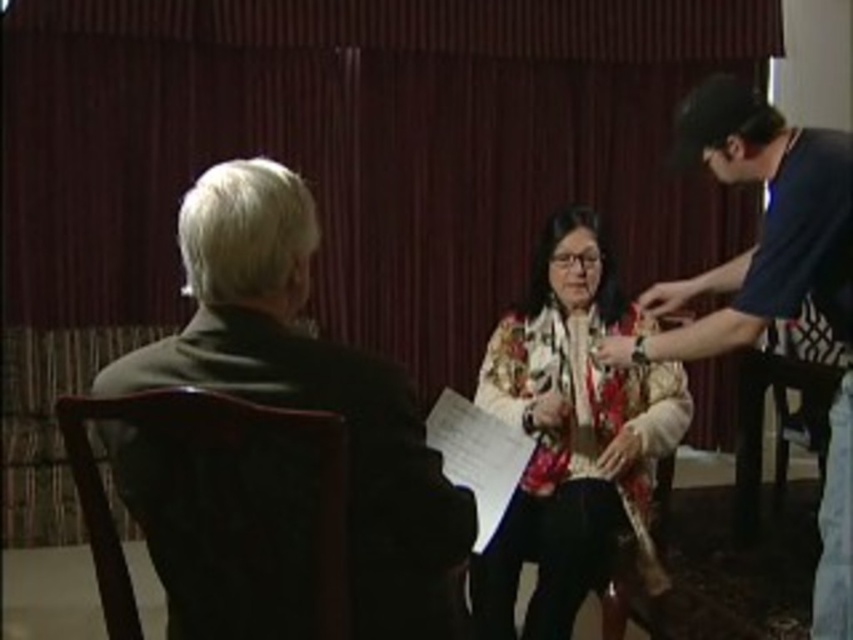
You are organizing a small event and need to place a decorative pillow between the dark brown leather jacket at left and the wooden chair at left. Which object should the pillow be closer to if it needs to be placed near the larger object?

The dark brown leather jacket at left is bigger than the wooden chair at left, so the decorative pillow should be placed closer to the dark brown leather jacket at left.

In the scene shown: You are standing in the room and want to move from the wooden chair at left to the wooden chair at lower right. Which direction should you move in?

Since the wooden chair at left is closer to the viewer than the wooden chair at lower right, you should move towards the lower right direction to reach the wooden chair at lower right from the wooden chair at left.